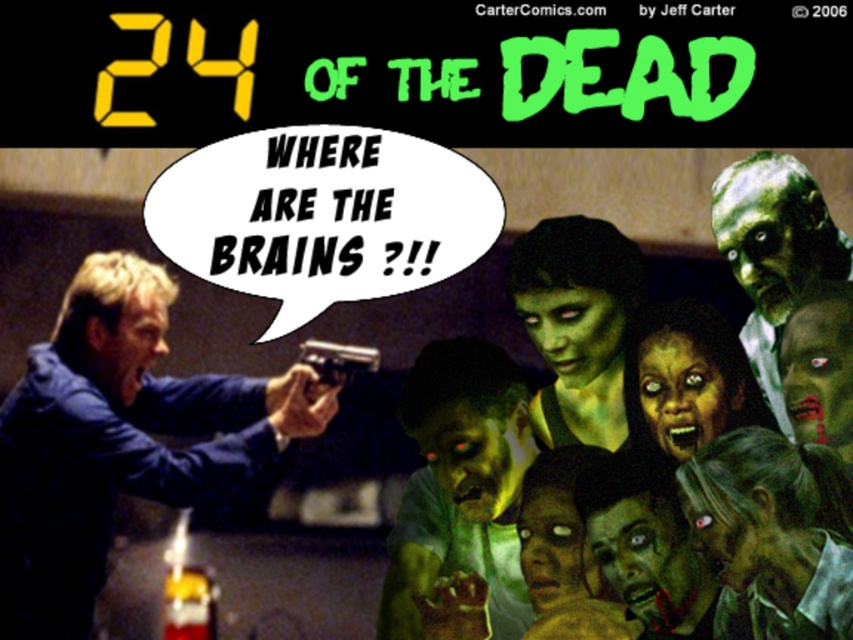
Question: Is green matte zombie at center wider than green matte face at center?

Choices:
 (A) yes
 (B) no

Answer: (B)

Question: Which object is positioned farthest from the green matte zombie at center?

Choices:
 (A) blue fabric jacket at left
 (B) green matte face at center
 (C) greenish skin zombie at center
 (D) green matte zombie head at center

Answer: (A)

Question: Estimate the real-world distances between objects in this image. Which object is closer to the green matte zombie at center?

Choices:
 (A) green matte zombie head at center
 (B) green matte face at center

Answer: (B)

Question: Does green matte zombie head at center appear under green matte face at center?

Choices:
 (A) no
 (B) yes

Answer: (B)

Question: Does blue fabric jacket at left appear over green matte zombie head at center?

Choices:
 (A) no
 (B) yes

Answer: (B)

Question: Which of these objects is positioned closest to the blue fabric jacket at left?

Choices:
 (A) green matte zombie head at center
 (B) green matte zombie at center
 (C) green matte face at center
 (D) greenish skin zombie at center

Answer: (A)